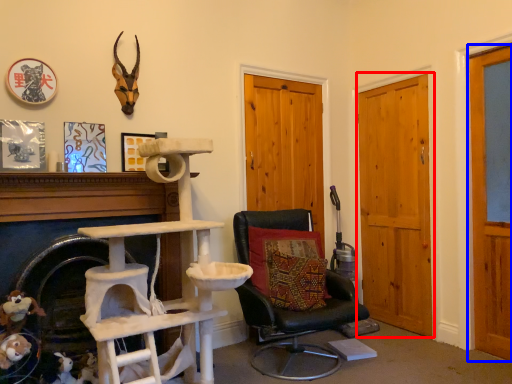
Question: Which object appears closest to the camera in this image, door (highlighted by a red box) or door (highlighted by a blue box)?

Choices:
 (A) door
 (B) door

Answer: (B)